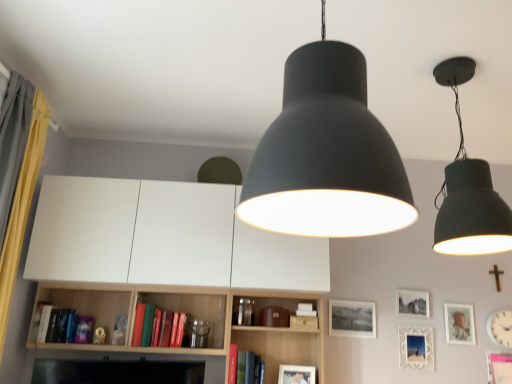
Question: Considering the relative sizes of wooden cross at upper right and matte black lampshade at center, acting as the 2th lamp starting from the right, in the image provided, is wooden cross at upper right wider than matte black lampshade at center, acting as the 2th lamp starting from the right,?

Choices:
 (A) yes
 (B) no

Answer: (B)

Question: From the image's perspective, is wooden cross at upper right located above matte black lampshade at center, acting as the 2th lamp starting from the right?

Choices:
 (A) no
 (B) yes

Answer: (A)

Question: Can you confirm if wooden cross at upper right is thinner than matte black lampshade at center, arranged as the first lamp when viewed from the left?

Choices:
 (A) no
 (B) yes

Answer: (B)

Question: Can matte black lampshade at center, acting as the 2th lamp starting from the right, be found inside wooden cross at upper right?

Choices:
 (A) yes
 (B) no

Answer: (B)

Question: Is wooden cross at upper right not near matte black lampshade at center, the 1th lamp in the front-to-back sequence?

Choices:
 (A) no
 (B) yes

Answer: (B)

Question: From the image's perspective, does wooden cross at upper right appear lower than matte black lampshade at center, which appears as the 2th lamp when viewed from the back?

Choices:
 (A) yes
 (B) no

Answer: (A)

Question: Is hardcover book at lower left, which is the 1th book from top to bottom, completely or partially outside of white matte picture frame at lower center, the 1th picture frame in the left-to-right sequence?

Choices:
 (A) yes
 (B) no

Answer: (A)

Question: From the image's perspective, is hardcover book at lower left, which is the 1th book from top to bottom, above white matte picture frame at lower center, the 1th picture frame in the left-to-right sequence?

Choices:
 (A) yes
 (B) no

Answer: (A)

Question: From a real-world perspective, is hardcover book at lower left, the second book positioned from the right, located beneath white matte picture frame at lower center, the 1th picture frame in the left-to-right sequence?

Choices:
 (A) no
 (B) yes

Answer: (A)

Question: Does hardcover book at lower left, the second book positioned from the right, have a greater height compared to white matte picture frame at lower center, arranged as the 5th picture frame when viewed from the right?

Choices:
 (A) yes
 (B) no

Answer: (A)

Question: Is hardcover book at lower left, the 2th book positioned from the bottom, positioned with its back to white matte picture frame at lower center, the 1th picture frame in the left-to-right sequence?

Choices:
 (A) yes
 (B) no

Answer: (B)

Question: Does hardcover book at lower left, the 2th book positioned from the bottom, have a lesser height compared to white matte picture frame at lower center, the 1th picture frame in the left-to-right sequence?

Choices:
 (A) no
 (B) yes

Answer: (A)

Question: Does matte black lampshade at center, the 1th lamp in the front-to-back sequence, come in front of yellow fabric curtain at left?

Choices:
 (A) yes
 (B) no

Answer: (A)